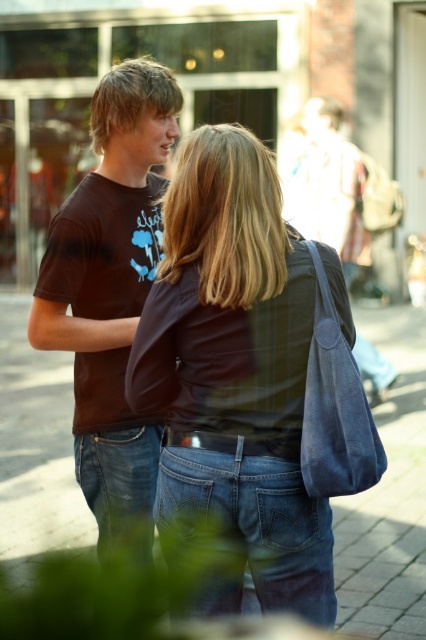
You are a photographer trying to capture a candid shot of the two people in the scene. You notice the dark brown leather jacket at center and the blue denim jeans at lower center. Which object should you focus on to ensure the subject in the foreground is properly in focus?

The dark brown leather jacket at center should be focused on because it is in front of the blue denim jeans at lower center, making it the foreground subject.